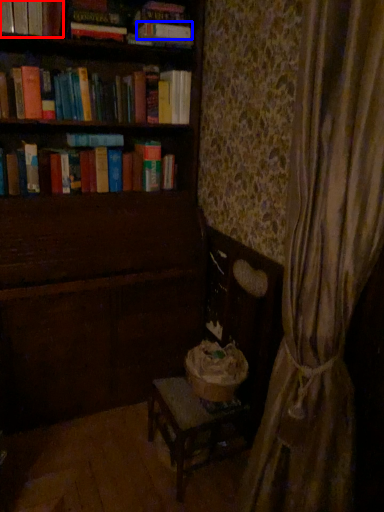
Question: Among these objects, which one is nearest to the camera, book (highlighted by a red box) or paperback book (highlighted by a blue box)?

Choices:
 (A) book
 (B) paperback book

Answer: (A)